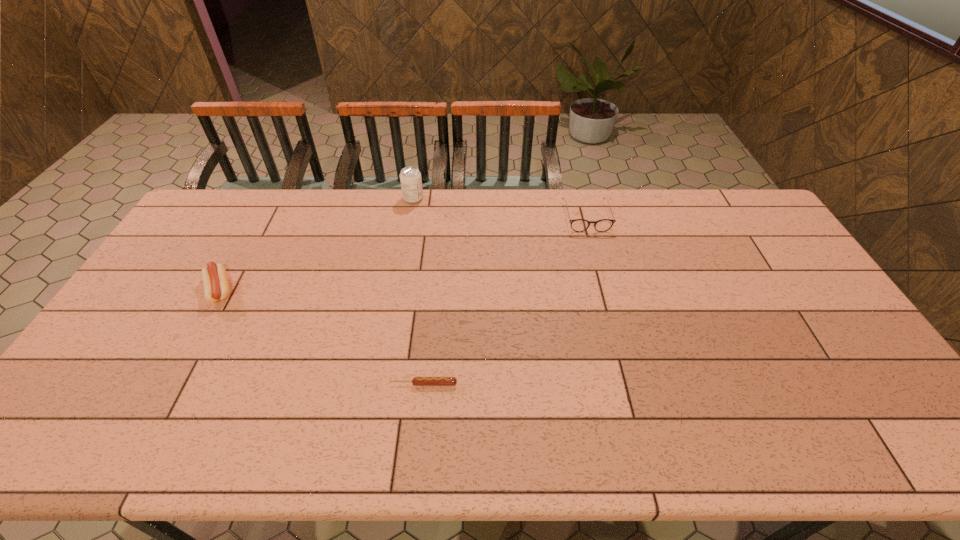
Where is `unoccupied area between the nearer sausage and the rightmost object`? This screenshot has width=960, height=540. unoccupied area between the nearer sausage and the rightmost object is located at coordinates [x=505, y=300].

Find the location of a particular element. empty space that is in between the second nearest object and the right sausage is located at coordinates (322, 336).

The image size is (960, 540). In order to click on free space between the spectacles and the taller sausage in this screenshot , I will do `click(403, 253)`.

Find the location of `vacant space that's between the tallest object and the left sausage`. vacant space that's between the tallest object and the left sausage is located at coordinates (317, 244).

This screenshot has width=960, height=540. Find the location of `vacant space that's between the rightmost object and the soda can`. vacant space that's between the rightmost object and the soda can is located at coordinates (500, 208).

Where is `free space that is in between the tallest object and the shortest object`? The image size is (960, 540). free space that is in between the tallest object and the shortest object is located at coordinates (419, 291).

Identify the location of free spot between the tallest object and the nearest object. This screenshot has height=540, width=960. (419, 291).

At what (x,y) coordinates should I click in order to perform the action: click on object that is the closest one to the tallest object. Please return your answer as a coordinate pair (x, y). This screenshot has height=540, width=960. Looking at the image, I should click on (578, 225).

Identify which object is the second closest to the right sausage. Please provide its 2D coordinates. Your answer should be formatted as a tuple, i.e. [(x, y)], where the tuple contains the x and y coordinates of a point satisfying the conditions above.

[(578, 225)]

The width and height of the screenshot is (960, 540). What are the coordinates of `vacant area that satisfies the following two spatial constraints: 1. on the front side of the farther sausage; 2. on the right side of the shorter sausage` in the screenshot? It's located at (168, 384).